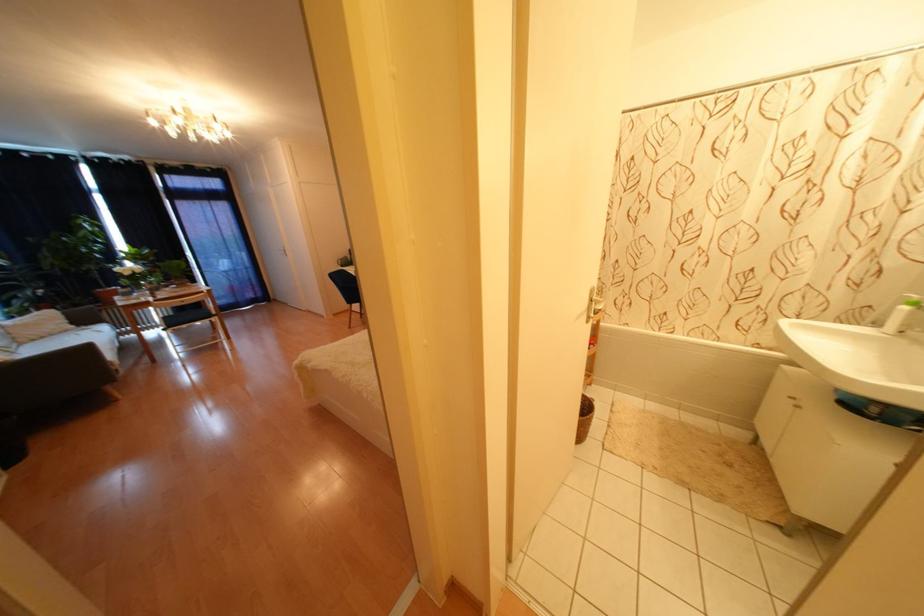
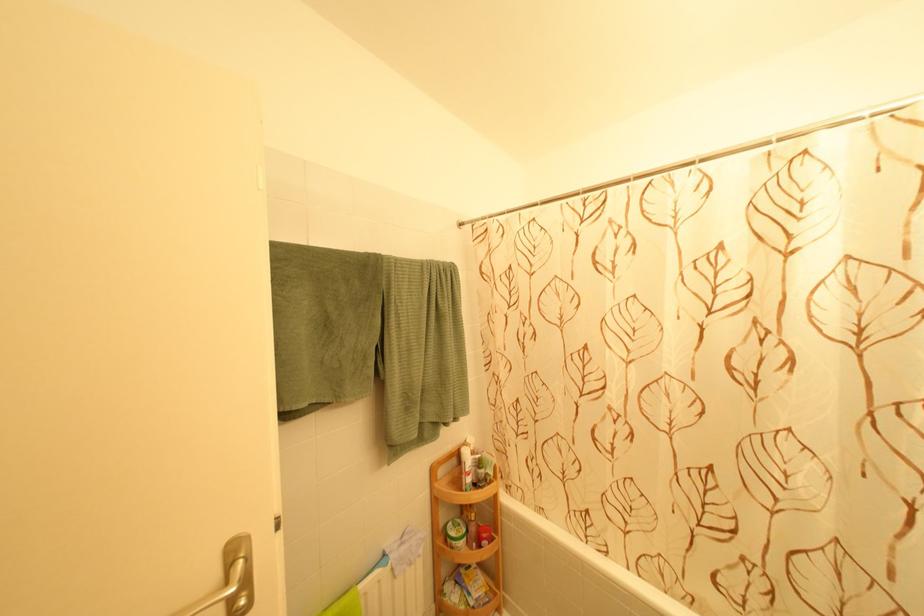
What movement of the cameraman would produce the second image?

The cameraman walked toward right, forward.